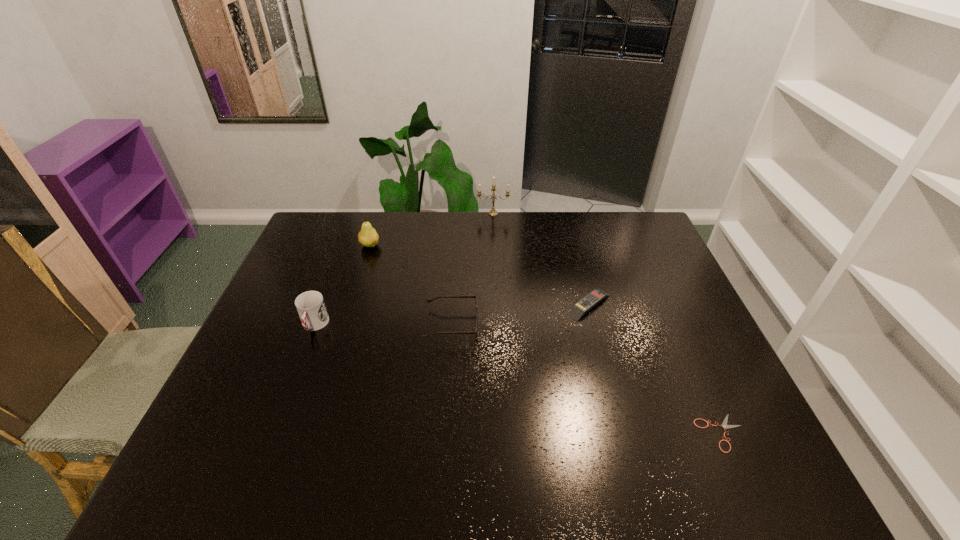
Select which object appears as the fourth closest to the sunglasses. Please provide its 2D coordinates. Your answer should be formatted as a tuple, i.e. [(x, y)], where the tuple contains the x and y coordinates of a point satisfying the conditions above.

[(493, 212)]

The height and width of the screenshot is (540, 960). I want to click on vacant space that satisfies the following two spatial constraints: 1. on the front lenses of the sunglasses; 2. on the handle side of the cup, so click(x=451, y=326).